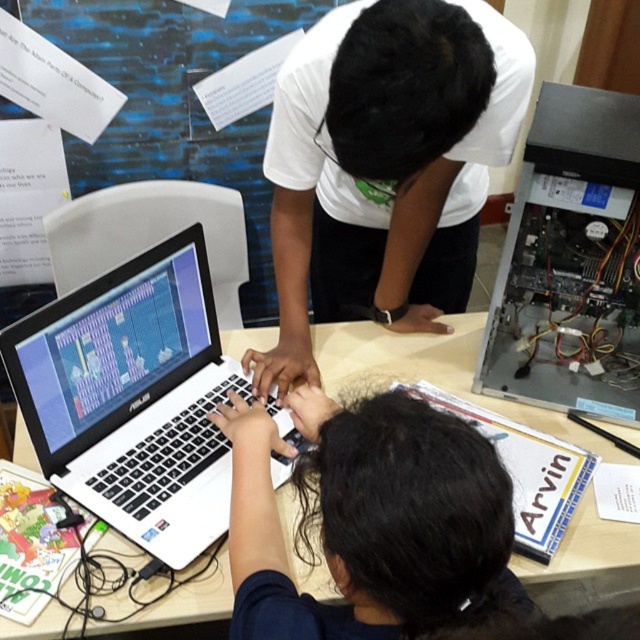
Looking at this image, you are a student who needs to reach both the black matte laptop at center and the blue paper at upper left during your work. Given that your arm can comfortably reach 80 centimeters, will you be able to access both items without moving your chair?

The black matte laptop at center and the blue paper at upper left are 86.13 centimeters apart from each other. Since your arm can only reach 80 centimeters, you will not be able to comfortably reach both items without moving your chair.

You are a student who needs to hand in an assignment. You see the black matte laptop at center and the blue paper at upper left. Which one is closer to you?

The black matte laptop at center is closer to you because it is in front of the blue paper at upper left.

You are a technician trying to access the USB ports on the white matte table at center. The black matte laptop at center is blocking your way. Can you move the laptop to the side to gain access?

The black matte laptop at center is positioned under the white matte table at center, so it is already under the table and not blocking access to the USB ports. Therefore, you can access the USB ports without moving the laptop.